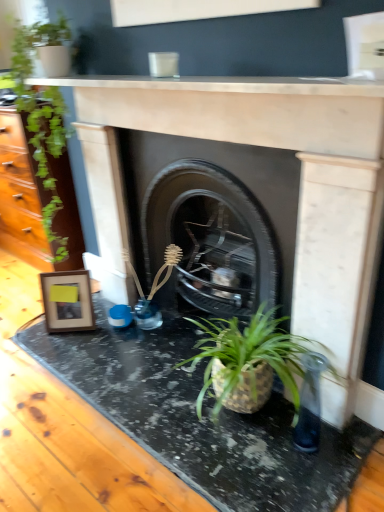
Question: Does wooden photo frame at left have a greater width compared to white marble fireplace at upper center, which is counted as the 2th counter top, starting from the bottom?

Choices:
 (A) yes
 (B) no

Answer: (B)

Question: Is wooden photo frame at left placed right next to white marble fireplace at upper center, acting as the 1th counter top starting from the top?

Choices:
 (A) no
 (B) yes

Answer: (A)

Question: Considering the relative sizes of wooden photo frame at left and white marble fireplace at upper center, which is counted as the 2th counter top, starting from the bottom, in the image provided, is wooden photo frame at left smaller than white marble fireplace at upper center, which is counted as the 2th counter top, starting from the bottom,?

Choices:
 (A) yes
 (B) no

Answer: (B)

Question: Considering the relative positions of wooden photo frame at left and white marble fireplace at upper center, acting as the 1th counter top starting from the top, in the image provided, is wooden photo frame at left to the left of white marble fireplace at upper center, acting as the 1th counter top starting from the top, from the viewer's perspective?

Choices:
 (A) yes
 (B) no

Answer: (A)

Question: From a real-world perspective, is wooden photo frame at left under white marble fireplace at upper center, which is counted as the 2th counter top, starting from the bottom?

Choices:
 (A) no
 (B) yes

Answer: (B)

Question: In the image, is wooden photo frame at left positioned in front of or behind green leafy plant at left?

Choices:
 (A) front
 (B) behind

Answer: (B)

Question: Is point (74, 290) positioned closer to the camera than point (56, 159)?

Choices:
 (A) farther
 (B) closer

Answer: (A)

Question: Looking at their shapes, would you say wooden photo frame at left is wider or thinner than green leafy plant at left?

Choices:
 (A) thin
 (B) wide

Answer: (A)

Question: From a real-world perspective, is wooden photo frame at left above or below green leafy plant at left?

Choices:
 (A) below
 (B) above

Answer: (A)

Question: Is matte stone fireplace at center, the second fireplace positioned from the back, spatially inside black marble counter top at lower center, which is the second counter top from top to bottom, or outside of it?

Choices:
 (A) inside
 (B) outside

Answer: (B)

Question: Is matte stone fireplace at center, which ranks as the first fireplace in front-to-back order, in front of or behind black marble counter top at lower center, which is the second counter top from top to bottom, in the image?

Choices:
 (A) front
 (B) behind

Answer: (A)

Question: Based on their sizes in the image, would you say matte stone fireplace at center, the second fireplace positioned from the back, is bigger or smaller than black marble counter top at lower center, which is the 1th counter top in bottom-to-top order?

Choices:
 (A) big
 (B) small

Answer: (A)

Question: Is matte stone fireplace at center, which ranks as the first fireplace in front-to-back order, taller or shorter than black marble counter top at lower center, which is the second counter top from top to bottom?

Choices:
 (A) tall
 (B) short

Answer: (A)

Question: Would you say green leafy plant at left is to the left or to the right of wooden photo frame at left in the picture?

Choices:
 (A) right
 (B) left

Answer: (B)

Question: Is green leafy plant at left taller or shorter than wooden photo frame at left?

Choices:
 (A) tall
 (B) short

Answer: (A)